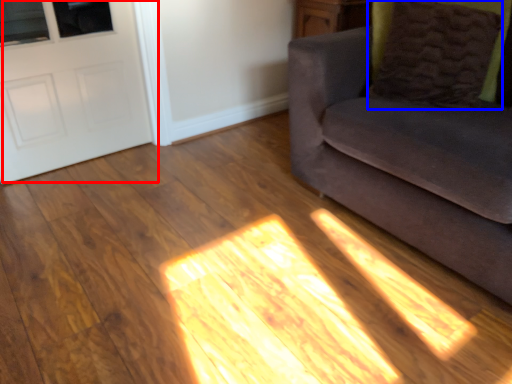
Question: Which of the following is the farthest to the observer, door (highlighted by a red box) or pillow (highlighted by a blue box)?

Choices:
 (A) door
 (B) pillow

Answer: (A)